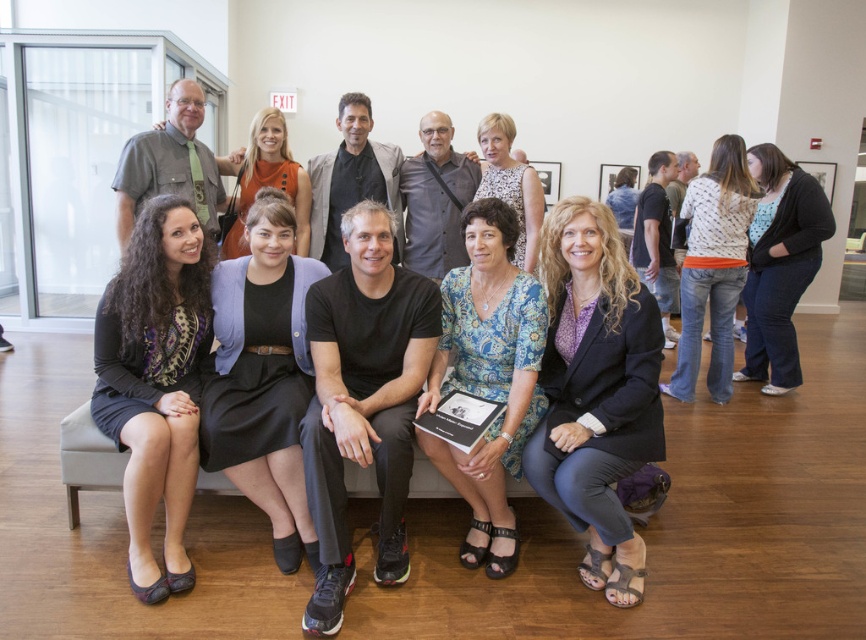
From the picture: You are a photographer trying to capture a group photo of the individuals in the scene. You notice the blue patterned blouse at center and the blonde hair at center. Which of these two items would you need to adjust to ensure they are both clearly visible in the photo?

The blue patterned blouse at center is thinner than the blonde hair at center, so you should adjust the focus on the thinner blue patterned blouse at center to ensure it is clearly visible alongside the thicker blonde hair at center.

You are organizing a photo shoot and need to ensure that the black fabric dress at center and the printed floral dress at center can fit side by side on a 1.5 meter wide platform. Based on the scene description, can both dresses fit comfortably?

The black fabric dress at center might be wider than the printed floral dress at center, so their combined width could exceed 1.5 meters. It is uncertain if they will fit comfortably without more specific measurements.

You are standing in the room and want to find the matte black dress at lower left and the matte gray shirt at upper left. Based on their positions, which one is closer to the left side of the room?

The matte gray shirt at upper left is closer to the left side of the room because the matte black dress at lower left is positioned to its right.